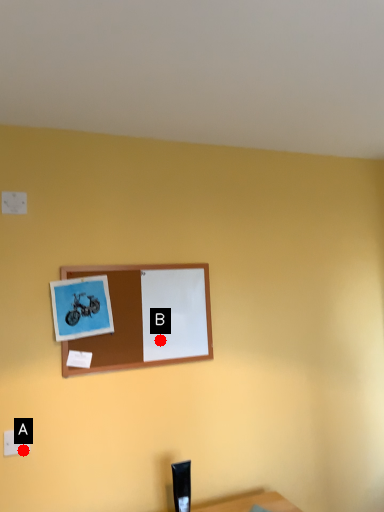
Question: Two points are circled on the image, labeled by A and B beside each circle. Which point appears closest to the camera in this image?

Choices:
 (A) A is closer
 (B) B is closer

Answer: (A)